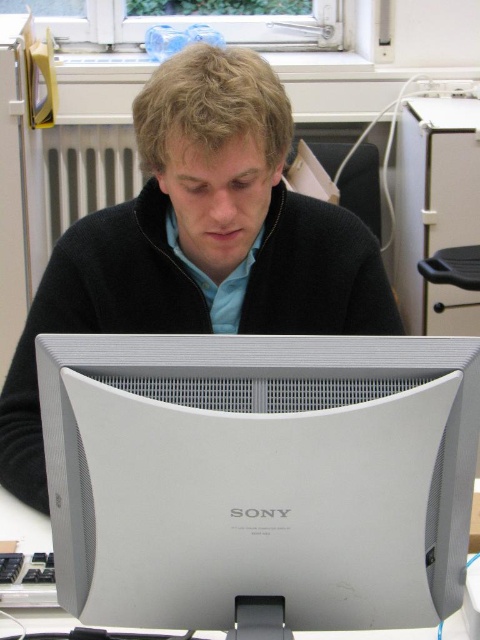
Question: Is satin silver monitor at center to the right of black matte sweater at center from the viewer's perspective?

Choices:
 (A) no
 (B) yes

Answer: (B)

Question: Where is satin silver monitor at center located in relation to black matte sweater at center in the image?

Choices:
 (A) left
 (B) right

Answer: (B)

Question: Does satin silver monitor at center appear under black matte sweater at center?

Choices:
 (A) no
 (B) yes

Answer: (B)

Question: Among these objects, which one is farthest from the camera?

Choices:
 (A) satin silver monitor at center
 (B) black matte sweater at center

Answer: (B)

Question: Among these points, which one is nearest to the camera?

Choices:
 (A) (179, 467)
 (B) (201, 44)

Answer: (A)